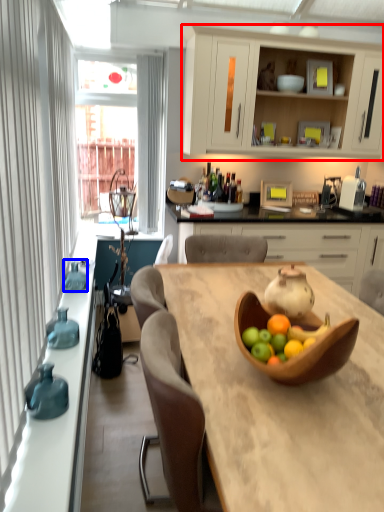
Question: Which of the following is the farthest to the observer, cabinetry (highlighted by a red box) or vase (highlighted by a blue box)?

Choices:
 (A) cabinetry
 (B) vase

Answer: (A)